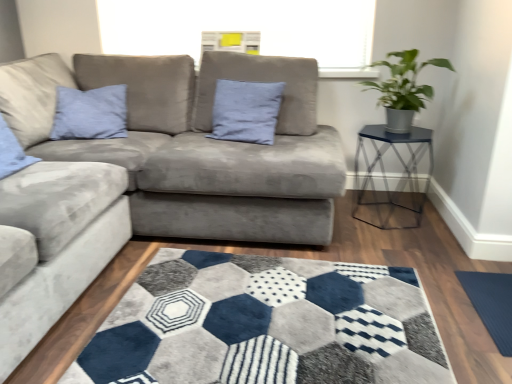
Question: Does green matte plant at upper right have a lesser width compared to metal hexagonal table at right?

Choices:
 (A) no
 (B) yes

Answer: (B)

Question: Does green matte plant at upper right come behind metal hexagonal table at right?

Choices:
 (A) yes
 (B) no

Answer: (B)

Question: Is green matte plant at upper right not inside metal hexagonal table at right?

Choices:
 (A) no
 (B) yes

Answer: (B)

Question: From the image's perspective, does green matte plant at upper right appear lower than metal hexagonal table at right?

Choices:
 (A) yes
 (B) no

Answer: (B)

Question: Can you confirm if green matte plant at upper right is positioned to the left of metal hexagonal table at right?

Choices:
 (A) no
 (B) yes

Answer: (B)

Question: Considering their positions, is green matte plant at upper right located in front of or behind suede blue pillow at center?

Choices:
 (A) behind
 (B) front

Answer: (B)

Question: From their relative heights in the image, would you say green matte plant at upper right is taller or shorter than suede blue pillow at center?

Choices:
 (A) tall
 (B) short

Answer: (B)

Question: Looking at their shapes, would you say green matte plant at upper right is wider or thinner than suede blue pillow at center?

Choices:
 (A) thin
 (B) wide

Answer: (B)

Question: From a real-world perspective, is green matte plant at upper right positioned above or below suede blue pillow at center?

Choices:
 (A) above
 (B) below

Answer: (A)

Question: Considering the positions of green matte plant at upper right and metal hexagonal table at right in the image, is green matte plant at upper right wider or thinner than metal hexagonal table at right?

Choices:
 (A) thin
 (B) wide

Answer: (A)

Question: Is point (394, 51) closer or farther from the camera than point (409, 180)?

Choices:
 (A) closer
 (B) farther

Answer: (A)

Question: Is green matte plant at upper right taller or shorter than metal hexagonal table at right?

Choices:
 (A) short
 (B) tall

Answer: (A)

Question: From the image's perspective, relative to metal hexagonal table at right, is green matte plant at upper right above or below?

Choices:
 (A) below
 (B) above

Answer: (B)

Question: Considering the positions of green matte plant at upper right and dark blue textured yoga mat at lower right in the image, is green matte plant at upper right bigger or smaller than dark blue textured yoga mat at lower right?

Choices:
 (A) big
 (B) small

Answer: (A)

Question: Considering the positions of point (394, 77) and point (504, 327), is point (394, 77) closer or farther from the camera than point (504, 327)?

Choices:
 (A) closer
 (B) farther

Answer: (B)